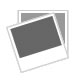
Locate an element on the screen. This screenshot has height=80, width=80. picture is located at coordinates (61, 20).